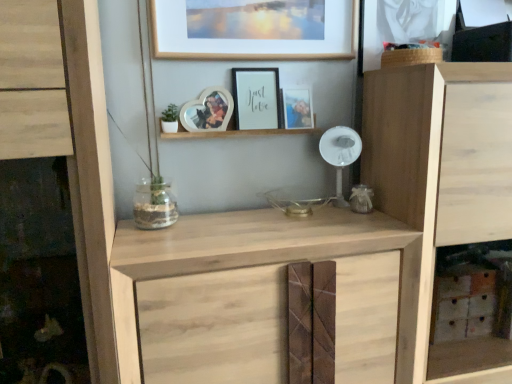
Question: From a real-world perspective, is natural wood cupboard at right, the second cupboard positioned from the left, over clear glass jar at center?

Choices:
 (A) no
 (B) yes

Answer: (A)

Question: Is natural wood cupboard at right, the second cupboard positioned from the left, with clear glass jar at center?

Choices:
 (A) yes
 (B) no

Answer: (B)

Question: Is natural wood cupboard at right, the first cupboard viewed from the right, to the right of clear glass jar at center from the viewer's perspective?

Choices:
 (A) no
 (B) yes

Answer: (B)

Question: Considering the relative sizes of natural wood cupboard at right, the first cupboard viewed from the right, and clear glass jar at center in the image provided, is natural wood cupboard at right, the first cupboard viewed from the right, wider than clear glass jar at center?

Choices:
 (A) no
 (B) yes

Answer: (B)

Question: Is natural wood cupboard at right, the second cupboard positioned from the left, positioned with its back to clear glass jar at center?

Choices:
 (A) yes
 (B) no

Answer: (B)

Question: Based on their positions, is clear glass jar at center located to the left or right of wooden picture frame at upper center, which is the 3th picture frame in left-to-right order?

Choices:
 (A) left
 (B) right

Answer: (A)

Question: Relative to wooden picture frame at upper center, which is the 3th picture frame in left-to-right order, is clear glass jar at center in front or behind?

Choices:
 (A) behind
 (B) front

Answer: (B)

Question: Which is correct: clear glass jar at center is inside wooden picture frame at upper center, the second picture frame in the right-to-left sequence, or outside of it?

Choices:
 (A) inside
 (B) outside

Answer: (B)

Question: From their relative heights in the image, would you say clear glass jar at center is taller or shorter than wooden picture frame at upper center, which is the 3th picture frame in left-to-right order?

Choices:
 (A) short
 (B) tall

Answer: (A)

Question: From a real-world perspective, relative to matte wooden picture frame at center, placed as the fourth picture frame when sorted from left to right, is natural wood cupboard at left, the 1th cupboard positioned from the left, vertically above or below?

Choices:
 (A) above
 (B) below

Answer: (B)

Question: Do you think natural wood cupboard at left, the 2th cupboard positioned from the right, is within matte wooden picture frame at center, placed as the fourth picture frame when sorted from left to right, or outside of it?

Choices:
 (A) inside
 (B) outside

Answer: (B)

Question: Considering the positions of natural wood cupboard at left, the 1th cupboard positioned from the left, and matte wooden picture frame at center, acting as the first picture frame starting from the right, in the image, is natural wood cupboard at left, the 1th cupboard positioned from the left, bigger or smaller than matte wooden picture frame at center, acting as the first picture frame starting from the right,?

Choices:
 (A) big
 (B) small

Answer: (A)

Question: Is natural wood cupboard at left, the 2th cupboard positioned from the right, taller or shorter than matte wooden picture frame at center, acting as the first picture frame starting from the right?

Choices:
 (A) tall
 (B) short

Answer: (A)

Question: Is natural wood cupboard at right, the second cupboard positioned from the left, to the left or to the right of natural wood cupboard at left, the 2th cupboard positioned from the right, in the image?

Choices:
 (A) right
 (B) left

Answer: (A)

Question: Considering the positions of point (399, 104) and point (38, 16), is point (399, 104) closer or farther from the camera than point (38, 16)?

Choices:
 (A) closer
 (B) farther

Answer: (B)